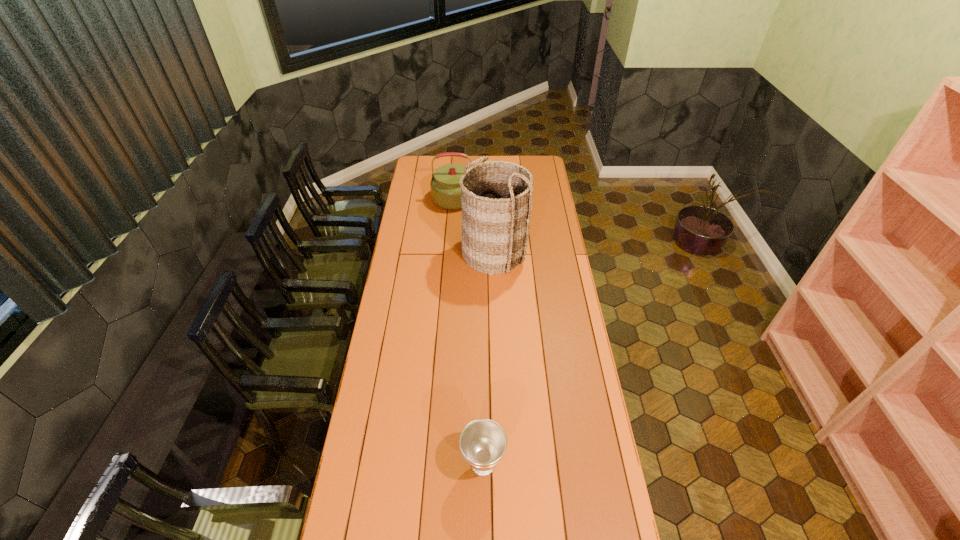
The height and width of the screenshot is (540, 960). Find the location of `basket`. basket is located at coordinates [x=496, y=196].

This screenshot has height=540, width=960. In order to click on the second nearest object in this screenshot , I will do `click(496, 196)`.

Where is `the farthest object`? the farthest object is located at coordinates point(445,189).

The width and height of the screenshot is (960, 540). Identify the location of the second tallest object. (445, 189).

At what (x,y) coordinates should I click in order to perform the action: click on the shortest object. Please return your answer as a coordinate pair (x, y). The image size is (960, 540). Looking at the image, I should click on (483, 442).

Identify the location of chalice. This screenshot has width=960, height=540. [483, 442].

Find the location of a particular element. The image size is (960, 540). vacant position located on the back of the tallest object is located at coordinates (492, 205).

I want to click on free space located 0.310m at the spout of the second tallest object, so click(x=543, y=199).

This screenshot has height=540, width=960. I want to click on vacant space located on the left of the nearest object, so click(x=428, y=464).

Where is `object located in the left edge section of the desktop`? object located in the left edge section of the desktop is located at coordinates (445, 189).